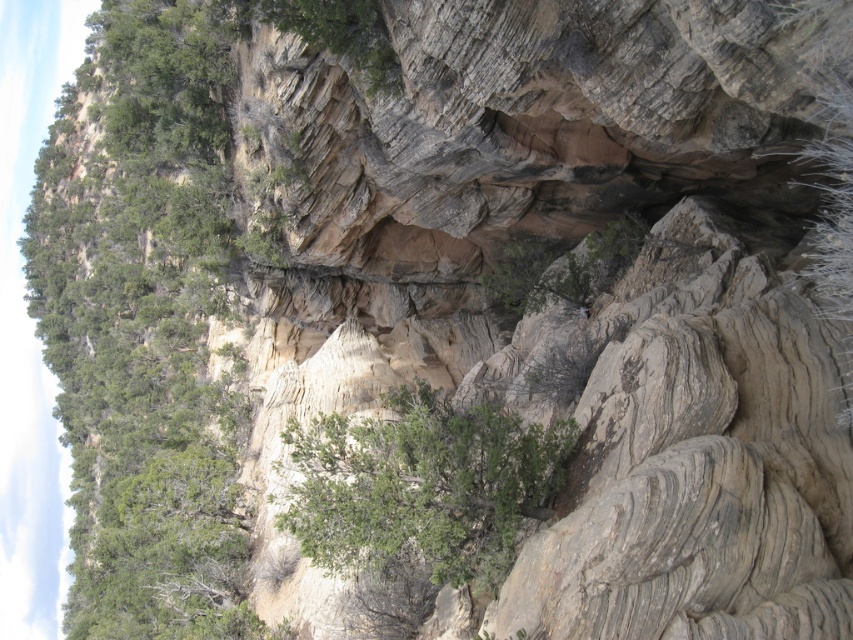
Can you confirm if green leafy tree at upper left is bigger than green leafy shrub at center?

Yes, green leafy tree at upper left is bigger than green leafy shrub at center.

Who is taller, green leafy tree at upper left or green leafy shrub at center?

green leafy tree at upper left

This screenshot has width=853, height=640. I want to click on green leafy tree at upper left, so click(144, 323).